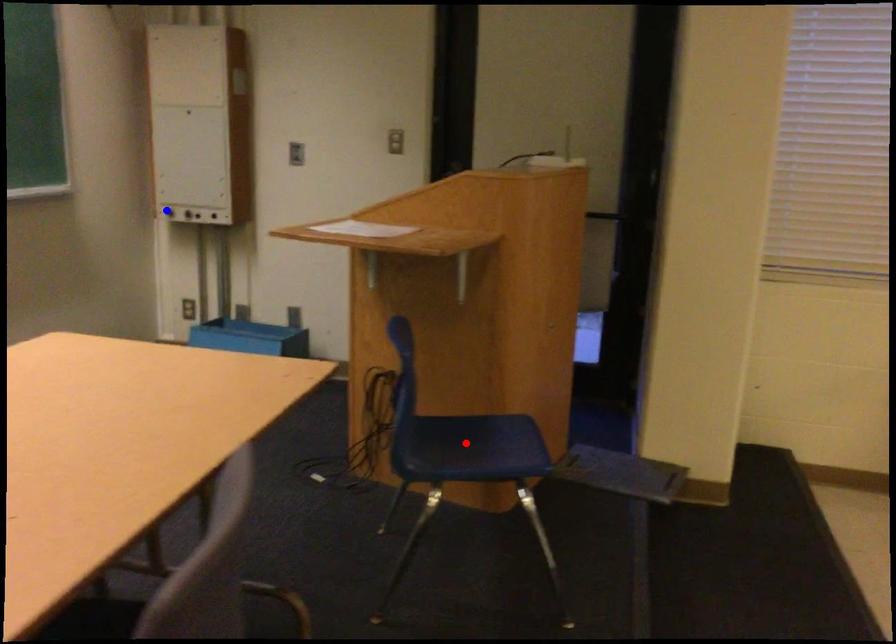
Question: Which of the two points in the image is closer to the camera?

Choices:
 (A) Blue point is closer.
 (B) Red point is closer.

Answer: (B)